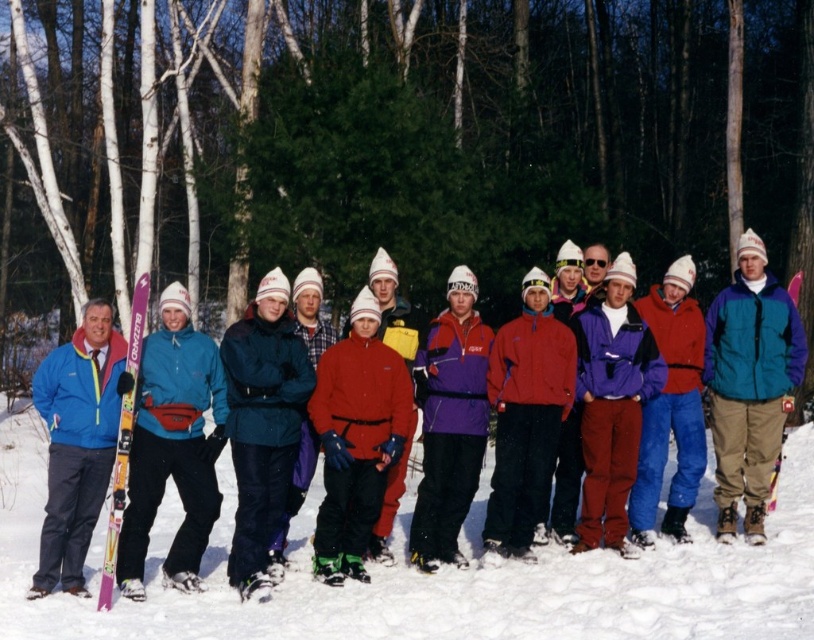
You are planning to place a pair of pink matte skis at left on the white powder snow at center. Will the skis fit entirely on the snow without any part hanging off the edge?

The white powder snow at center might be wider than pink matte skis at left, so there is a possibility that the skis will fit entirely on the snow without any part hanging off the edge.

You are planning to ski down the slope and see the white powder snow at center and the pink matte skis at left. Which object is positioned to the right of the other?

The white powder snow at center is to the right of the pink matte skis at left.

You are a ski equipment inspector checking the dimensions of the skis. You see the pink matte skis at left and the pink plastic ski at center. Which one has a shorter height?

The pink matte skis at left is not as tall as the pink plastic ski at center, so the pink matte skis at left has a shorter height.